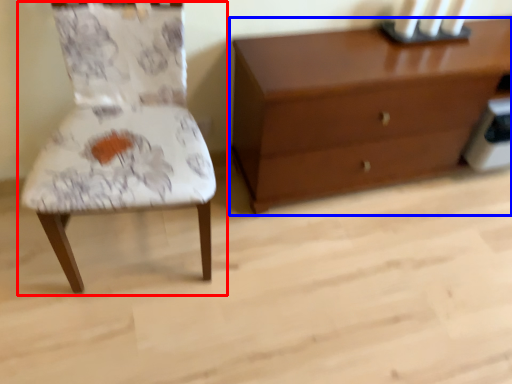
Question: Which point is further to the camera, chair (highlighted by a red box) or chest of drawers (highlighted by a blue box)?

Choices:
 (A) chair
 (B) chest of drawers

Answer: (B)